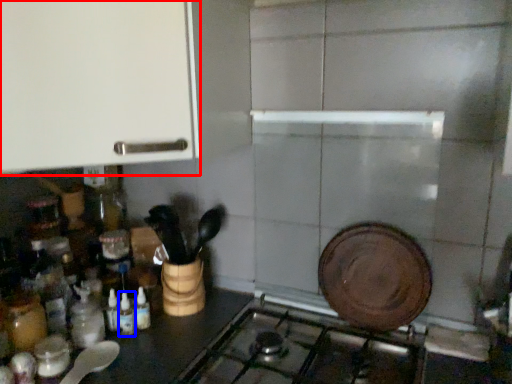
Question: Which of the following is the closest to the observer, cabinetry (highlighted by a red box) or bottle (highlighted by a blue box)?

Choices:
 (A) cabinetry
 (B) bottle

Answer: (A)